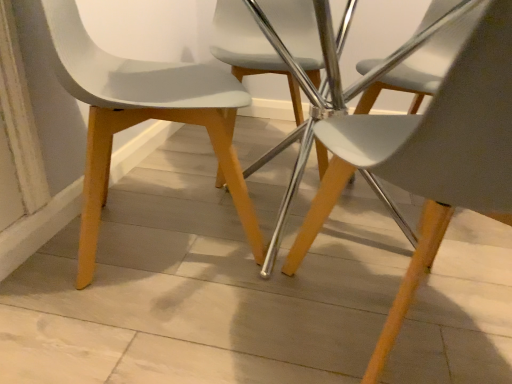
Question: Which direction should I rotate to look at matte white chair at center, the 3th chair when ordered from front to back?

Choices:
 (A) right
 (B) left

Answer: (A)

Question: Considering the relative sizes of matte white chair at center, the 3th chair when ordered from front to back, and matte white chair at left, placed as the second chair when sorted from back to front, in the image provided, is matte white chair at center, the 3th chair when ordered from front to back, shorter than matte white chair at left, placed as the second chair when sorted from back to front,?

Choices:
 (A) no
 (B) yes

Answer: (B)

Question: Is matte white chair at center, which is the 1th chair in back-to-front order, facing towards matte white chair at left, placed as the second chair when sorted from back to front?

Choices:
 (A) yes
 (B) no

Answer: (B)

Question: From the image's perspective, is matte white chair at center, the 3th chair when ordered from front to back, beneath matte white chair at left, arranged as the second chair when viewed from the front?

Choices:
 (A) yes
 (B) no

Answer: (B)

Question: Is matte white chair at left, placed as the second chair when sorted from back to front, completely or partially inside matte white chair at center, which is the 1th chair in back-to-front order?

Choices:
 (A) yes
 (B) no

Answer: (B)

Question: Is matte white chair at center, the 3th chair when ordered from front to back, at the right side of matte white chair at left, arranged as the second chair when viewed from the front?

Choices:
 (A) yes
 (B) no

Answer: (A)

Question: Does matte white chair at center, which is the 1th chair in back-to-front order, touch matte white chair at left, placed as the second chair when sorted from back to front?

Choices:
 (A) no
 (B) yes

Answer: (A)

Question: Does matte white chair at left, placed as the second chair when sorted from back to front, appear on the right side of white matte plastic chair at center, the 3th chair when ordered from back to front?

Choices:
 (A) no
 (B) yes

Answer: (A)

Question: Can you confirm if matte white chair at left, placed as the second chair when sorted from back to front, is taller than white matte plastic chair at center, the 3th chair when ordered from back to front?

Choices:
 (A) yes
 (B) no

Answer: (B)

Question: Is matte white chair at left, placed as the second chair when sorted from back to front, facing away from white matte plastic chair at center, the 1th chair in the front-to-back sequence?

Choices:
 (A) yes
 (B) no

Answer: (B)

Question: From the image's perspective, would you say matte white chair at left, arranged as the second chair when viewed from the front, is shown under white matte plastic chair at center, the 3th chair when ordered from back to front?

Choices:
 (A) yes
 (B) no

Answer: (B)

Question: Is matte white chair at left, arranged as the second chair when viewed from the front, with white matte plastic chair at center, the 3th chair when ordered from back to front?

Choices:
 (A) yes
 (B) no

Answer: (B)

Question: Is matte white chair at left, placed as the second chair when sorted from back to front, far from white matte plastic chair at center, the 1th chair in the front-to-back sequence?

Choices:
 (A) no
 (B) yes

Answer: (A)

Question: Does matte white chair at left, placed as the second chair when sorted from back to front, have a lesser height compared to matte white chair at center, the 3th chair when ordered from front to back?

Choices:
 (A) no
 (B) yes

Answer: (A)